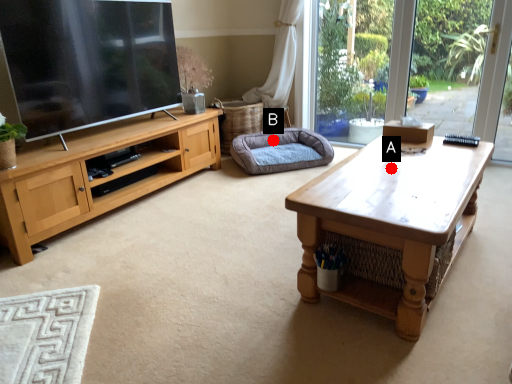
Question: Two points are circled on the image, labeled by A and B beside each circle. Which point is closer to the camera taking this photo?

Choices:
 (A) A is closer
 (B) B is closer

Answer: (A)